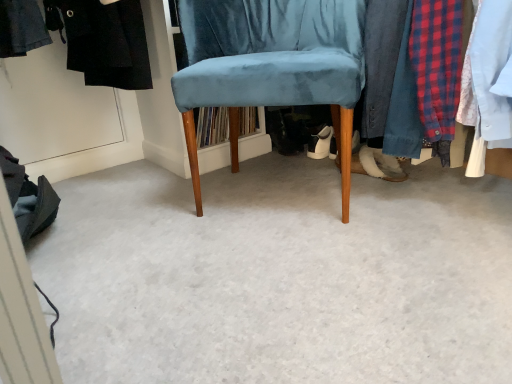
The height and width of the screenshot is (384, 512). What do you see at coordinates (271, 62) in the screenshot?
I see `velvet blue chair at center` at bounding box center [271, 62].

Find the location of a particular element. velvet blue chair at center is located at coordinates (271, 62).

Locate an element on the screen. The height and width of the screenshot is (384, 512). velvet blue chair at center is located at coordinates (271, 62).